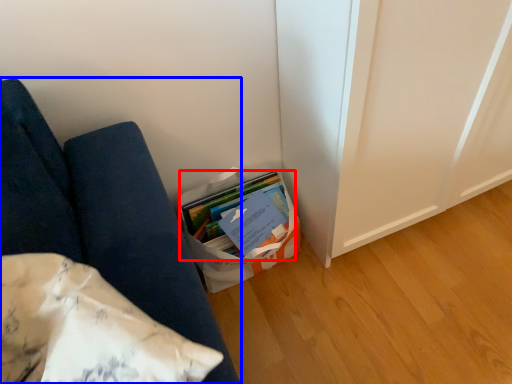
Question: Which object appears closest to the camera in this image, book (highlighted by a red box) or furniture (highlighted by a blue box)?

Choices:
 (A) book
 (B) furniture

Answer: (B)